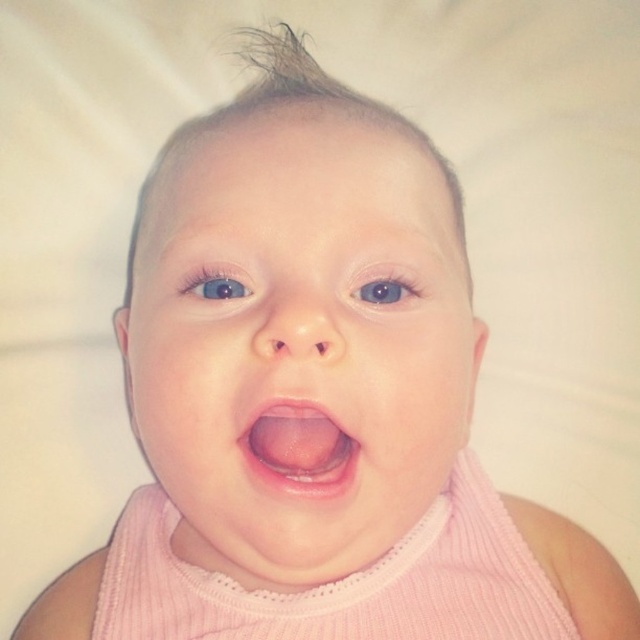
You are a photographer adjusting the focus on your camera. You have two points in the image to focus on, point (312, 372) and point (305, 442). Which point should you focus on to ensure the closest object is sharp?

Point (312, 372) is closer to the camera than point (305, 442), so you should focus on point (312, 372) to ensure the closest object is sharp.